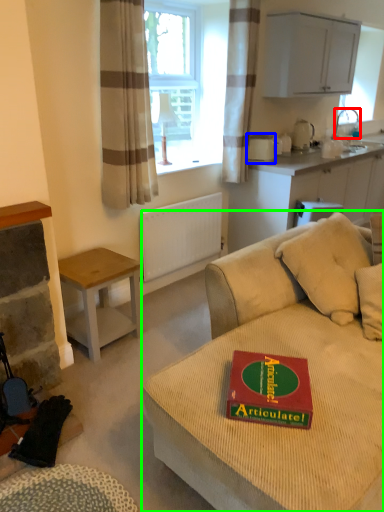
Question: Considering the real-world distances, which object is closest to faucet (highlighted by a red box)? appliance (highlighted by a blue box) or studio couch (highlighted by a green box).

Choices:
 (A) appliance
 (B) studio couch

Answer: (A)